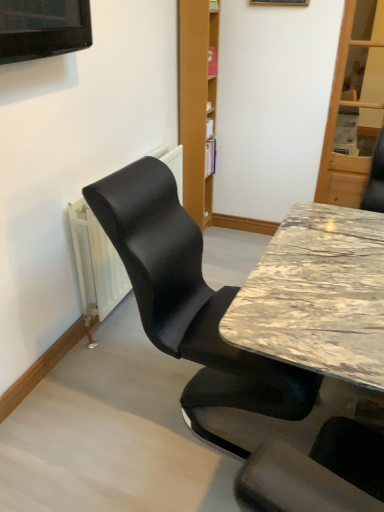
Question: Based on their sizes in the image, would you say black leather chair at left is bigger or smaller than wooden bookshelf at upper center?

Choices:
 (A) big
 (B) small

Answer: (A)

Question: Considering the positions of black leather chair at left and wooden bookshelf at upper center in the image, is black leather chair at left wider or thinner than wooden bookshelf at upper center?

Choices:
 (A) thin
 (B) wide

Answer: (B)

Question: Considering the real-world distances, which object is closest to the metallic gold picture frame at upper center?

Choices:
 (A) marble table at center
 (B) black leather chair at left
 (C) wooden bookshelf at upper center

Answer: (C)

Question: Considering the real-world distances, which object is farthest from the metallic gold picture frame at upper center?

Choices:
 (A) marble table at center
 (B) black leather chair at left
 (C) wooden bookshelf at upper center

Answer: (B)